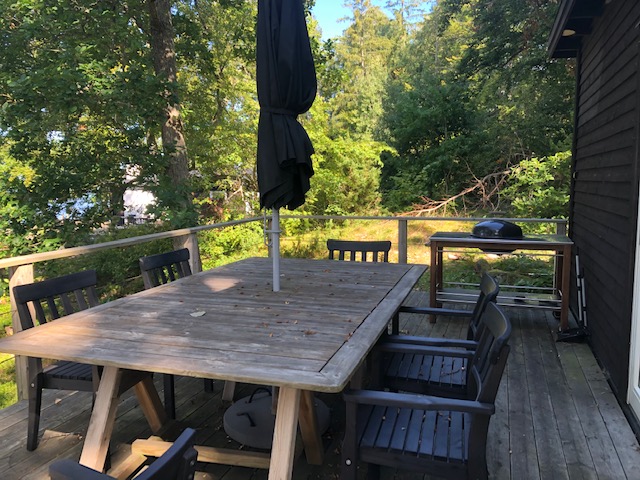
I want to click on wooden table, so click(255, 340).